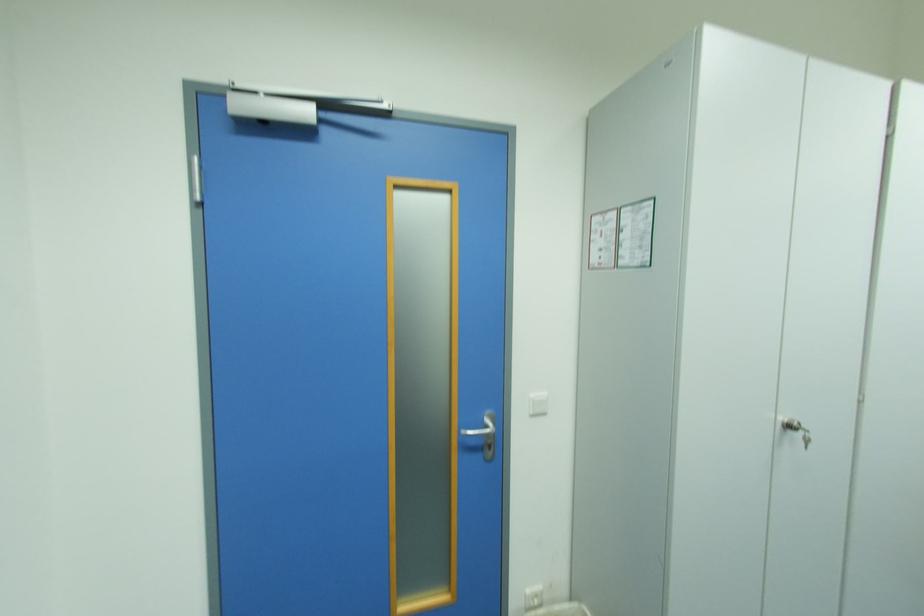
Identify the location of white light switch. Image resolution: width=924 pixels, height=616 pixels. (538, 403).